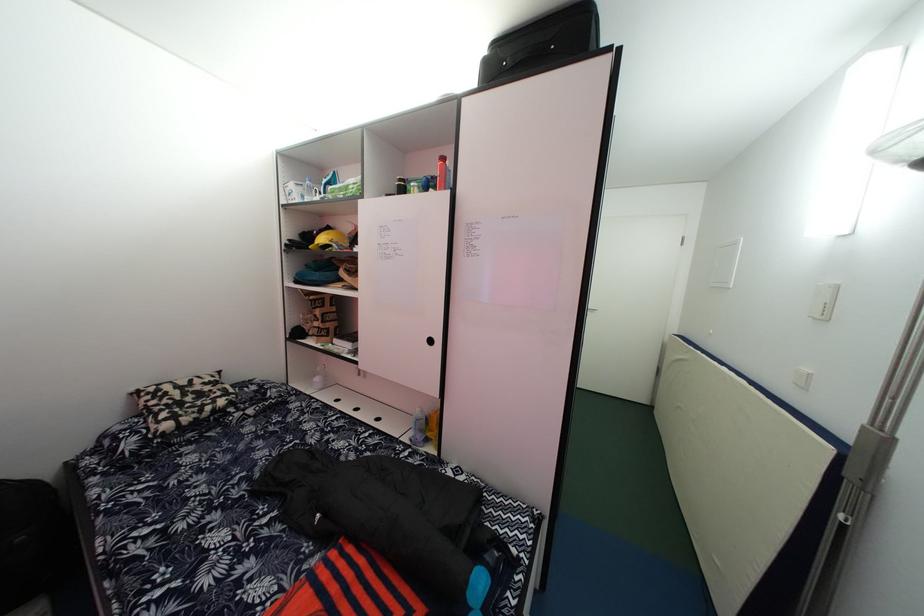
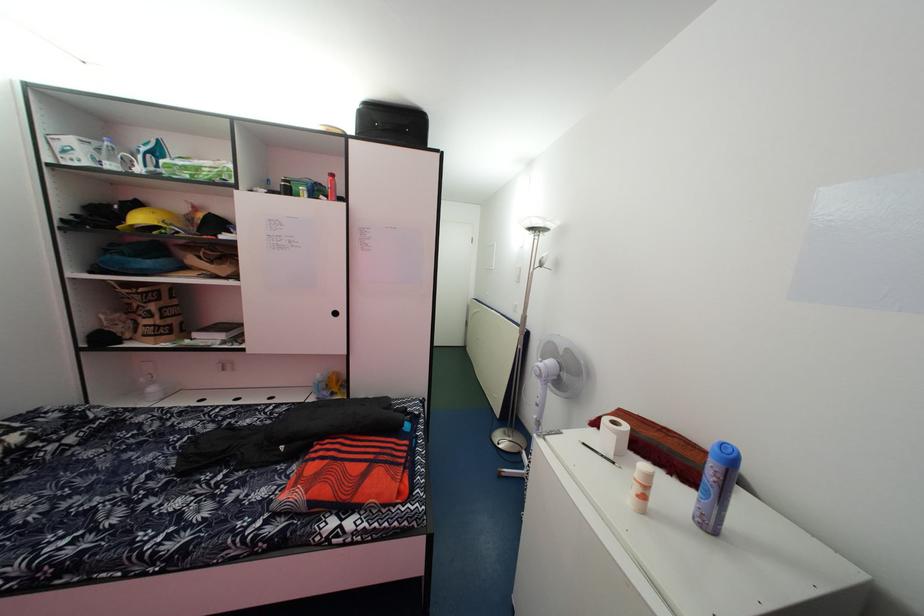
Where in the second image is the point corresponding to (x=300, y=192) from the first image?

(79, 148)